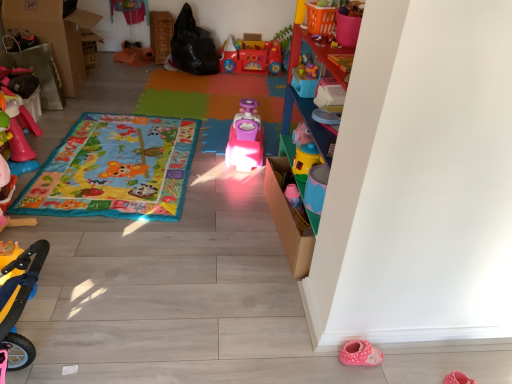
Describe the element at coordinates (215, 103) in the screenshot. I see `matte pink car at center, the first blanket when ordered from back to front` at that location.

Describe the element at coordinates (192, 46) in the screenshot. The image size is (512, 384). I see `black matte bag at upper center` at that location.

Describe the element at coordinates (245, 138) in the screenshot. I see `pink plastic toy at center, acting as the 4th toy starting from the right` at that location.

This screenshot has height=384, width=512. What are the coordinates of `pink plastic toy at center, acting as the 4th toy starting from the right` in the screenshot? It's located at (x=245, y=138).

The image size is (512, 384). What do you see at coordinates (250, 56) in the screenshot? I see `rubberized red toy car at center, which is the 3th toy in right-to-left order` at bounding box center [250, 56].

What do you see at coordinates (54, 34) in the screenshot? This screenshot has height=384, width=512. I see `cardboard box at left` at bounding box center [54, 34].

Locate an element on the screen. matte pink car at center, the first blanket when ordered from back to front is located at coordinates (215, 103).

Can you tell me how much black matte bag at upper center and yellow plastic scooter at lower left, placed as the 5th toy when sorted from right to left, differ in facing direction?

90.8 degrees separate the facing orientations of black matte bag at upper center and yellow plastic scooter at lower left, placed as the 5th toy when sorted from right to left.

From the image's perspective, which is below, black matte bag at upper center or yellow plastic scooter at lower left, the fourth toy positioned from the left?

yellow plastic scooter at lower left, the fourth toy positioned from the left, appears lower in the image.

Where is `the 1st toy counting from the left of the black matte bag at upper center`? Image resolution: width=512 pixels, height=384 pixels. the 1st toy counting from the left of the black matte bag at upper center is located at coordinates tap(19, 303).

Is black matte bag at upper center in front of or behind yellow plastic scooter at lower left, arranged as the first toy when viewed from the front, in the image?

black matte bag at upper center is positioned farther from the viewer than yellow plastic scooter at lower left, arranged as the first toy when viewed from the front.

From a real-world perspective, which object stands above the other?

From a 3D spatial view, cardboard box at left is above.

Which of these two, multicolored fabric play mat at center, which is counted as the second blanket, starting from the back, or cardboard box at left, is wider?

With larger width is multicolored fabric play mat at center, which is counted as the second blanket, starting from the back.

Based on the photo, could you tell me if multicolored fabric play mat at center, which is counted as the second blanket, starting from the back, is turned towards cardboard box at left?

No.

Which of these two, multicolored fabric play mat at center, the 1th blanket viewed from the front, or cardboard box at left, stands shorter?

multicolored fabric play mat at center, the 1th blanket viewed from the front, is shorter.

In terms of height, does black matte bag at upper center look taller or shorter compared to pink plastic toy at center, acting as the 4th toy starting from the right?

Clearly, black matte bag at upper center is taller compared to pink plastic toy at center, acting as the 4th toy starting from the right.

Between black matte bag at upper center and pink plastic toy at center, marked as the 3th toy in a back-to-front arrangement, which one is positioned in front?

Positioned in front is pink plastic toy at center, marked as the 3th toy in a back-to-front arrangement.

Is black matte bag at upper center far away from pink plastic toy at center, which is the fifth toy in left-to-right order?

Yes, black matte bag at upper center is far from pink plastic toy at center, which is the fifth toy in left-to-right order.

Is rubberized red toy car at center, which ranks as the 6th toy in left-to-right order, inside or outside of orange fabric toy at upper left, the sixth toy in the right-to-left sequence?

rubberized red toy car at center, which ranks as the 6th toy in left-to-right order, is not inside orange fabric toy at upper left, the sixth toy in the right-to-left sequence, it's outside.

Who is bigger, rubberized red toy car at center, which appears as the first toy when viewed from the back, or orange fabric toy at upper left, the sixth toy in the right-to-left sequence?

rubberized red toy car at center, which appears as the first toy when viewed from the back, is bigger.

Is point (242, 62) closer or farther from the camera than point (144, 60)?

Point (242, 62) appears to be farther away from the viewer than point (144, 60).

From the image's perspective, is rubberized red toy car at center, which is the 3th toy in right-to-left order, located above orange fabric toy at upper left, the sixth toy in the right-to-left sequence?

Yes, from the image's perspective, rubberized red toy car at center, which is the 3th toy in right-to-left order, is over orange fabric toy at upper left, the sixth toy in the right-to-left sequence.

Considering the sizes of objects yellow plastic cup at upper right, the 2th toy in the right-to-left sequence, and pink rubber shoe at upper right in the image provided, who is shorter, yellow plastic cup at upper right, the 2th toy in the right-to-left sequence, or pink rubber shoe at upper right?

With less height is pink rubber shoe at upper right.

Is point (315, 150) behind point (338, 122)?

Yes, point (315, 150) is behind point (338, 122).

Is yellow plastic cup at upper right, the 2th toy in the right-to-left sequence, wider or thinner than pink rubber shoe at upper right?

Considering their sizes, yellow plastic cup at upper right, the 2th toy in the right-to-left sequence, looks slimmer than pink rubber shoe at upper right.

Measure the distance from yellow plastic cup at upper right, which appears as the 7th toy when viewed from the left, to pink rubber shoe at upper right.

The distance of yellow plastic cup at upper right, which appears as the 7th toy when viewed from the left, from pink rubber shoe at upper right is 7.91 inches.

Locate an element on the screen. The height and width of the screenshot is (384, 512). the 1st blanket below the yellow plastic scooter at lower left, the fourth toy positioned from the left (from a real-world perspective) is located at coordinates (215, 103).

Are matte pink car at center, arranged as the second blanket when viewed from the front, and yellow plastic scooter at lower left, acting as the eighth toy starting from the back, far apart?

matte pink car at center, arranged as the second blanket when viewed from the front, is positioned a significant distance from yellow plastic scooter at lower left, acting as the eighth toy starting from the back.

Between point (205, 138) and point (0, 315), which one is positioned behind?

The point (205, 138) is behind.

Which object is wider, matte pink car at center, the first blanket when ordered from back to front, or yellow plastic scooter at lower left, acting as the eighth toy starting from the back?

With larger width is matte pink car at center, the first blanket when ordered from back to front.

Considering the sizes of objects yellow plastic cup at upper right, which appears as the 7th toy when viewed from the left, and rubberized yellow scooter at left, the seventh toy viewed from the right, in the image provided, who is wider, yellow plastic cup at upper right, which appears as the 7th toy when viewed from the left, or rubberized yellow scooter at left, the seventh toy viewed from the right,?

With larger width is yellow plastic cup at upper right, which appears as the 7th toy when viewed from the left.

Is rubberized yellow scooter at left, the 5th toy in the back-to-front sequence, located within yellow plastic cup at upper right, the 2th toy in the right-to-left sequence?

No, rubberized yellow scooter at left, the 5th toy in the back-to-front sequence, is not inside yellow plastic cup at upper right, the 2th toy in the right-to-left sequence.

Can you tell me how much yellow plastic cup at upper right, marked as the third toy in a front-to-back arrangement, and rubberized yellow scooter at left, acting as the 2th toy starting from the left, differ in facing direction?

178 degrees.

You are a GUI agent. You are given a task and a screenshot of the screen. Output one action in this format:
    pyautogui.click(x=<x>, y=<y>)
    Task: Click on the animal above the yellow plastic scooter at lower left, acting as the eighth toy starting from the back (from the image's perspective)
    The height and width of the screenshot is (384, 512).
    Given the screenshot: What is the action you would take?
    pyautogui.click(x=192, y=46)

Find the location of a particular element. Image resolution: width=512 pixels, height=384 pixels. blanket that is the 2nd one when counting forward from the cardboard box at left is located at coordinates (115, 169).

Estimate the real-world distances between objects in this image. Which object is further from rubberized pink toy at left, placed as the 5th toy when sorted from front to back, yellow plastic scooter at lower left, arranged as the first toy when viewed from the front, or pink plastic toy at center, acting as the 4th toy starting from the right?

The object further to rubberized pink toy at left, placed as the 5th toy when sorted from front to back, is yellow plastic scooter at lower left, arranged as the first toy when viewed from the front.

When comparing their distances from orange fabric toy at upper left, placed as the third toy when sorted from left to right, does multicolored fabric play mat at center, the 1th blanket viewed from the front, or matte pink car at center, arranged as the second blanket when viewed from the front, seem further?

Among the two, multicolored fabric play mat at center, the 1th blanket viewed from the front, is located further to orange fabric toy at upper left, placed as the third toy when sorted from left to right.

Looking at the image, which one is located closer to rubberized yellow scooter at left, the fourth toy viewed from the front, rubberized pink toy at left, placed as the 5th toy when sorted from front to back, or yellow plastic cup at upper right, acting as the sixth toy starting from the back?

rubberized pink toy at left, placed as the 5th toy when sorted from front to back, is closer to rubberized yellow scooter at left, the fourth toy viewed from the front.

Looking at the image, which one is located further to rubberized pink toy at left, which is counted as the 8th toy, starting from the right, orange fabric toy at upper left, the 2th toy positioned from the back, or pink plastic toy at center, which is the fifth toy in left-to-right order?

orange fabric toy at upper left, the 2th toy positioned from the back.

Looking at the image, which one is located closer to rubberized yellow scooter at left, the 5th toy in the back-to-front sequence, orange fabric toy at upper left, the sixth toy in the right-to-left sequence, or pink plastic toy at center, which is the fifth toy in left-to-right order?

Result: pink plastic toy at center, which is the fifth toy in left-to-right order, is positioned closer to the anchor rubberized yellow scooter at left, the 5th toy in the back-to-front sequence.

Looking at the image, which one is located further to matte pink car at center, the first blanket when ordered from back to front, rubberized pink toy at left, placed as the 5th toy when sorted from front to back, or cardboard box at left?

rubberized pink toy at left, placed as the 5th toy when sorted from front to back, is positioned further to the anchor matte pink car at center, the first blanket when ordered from back to front.

Considering their positions, is yellow plastic scooter at lower left, acting as the eighth toy starting from the back, positioned closer to black matte bag at upper center than pink plastic toy at center, which is the fifth toy in left-to-right order?

pink plastic toy at center, which is the fifth toy in left-to-right order, is closer to black matte bag at upper center.

Which object lies further to the anchor point rubberized red toy car at center, which appears as the 8th toy when viewed from the front, yellow plastic scooter at lower left, placed as the 5th toy when sorted from right to left, or multicolored fabric play mat at center, which is counted as the second blanket, starting from the back?

yellow plastic scooter at lower left, placed as the 5th toy when sorted from right to left.

Identify the location of cardboard box positioned between rubberized pink toy at left, positioned as the 1th toy in left-to-right order, and orange fabric toy at upper left, placed as the seventh toy when sorted from front to back, from near to far. The width and height of the screenshot is (512, 384). (54, 34).

Where is `blanket positioned between pink plastic toy at center, acting as the 4th toy starting from the right, and rubberized red toy car at center, which is the 3th toy in right-to-left order, from near to far`? The width and height of the screenshot is (512, 384). blanket positioned between pink plastic toy at center, acting as the 4th toy starting from the right, and rubberized red toy car at center, which is the 3th toy in right-to-left order, from near to far is located at coordinates (215, 103).

Find the location of a particular element. The width and height of the screenshot is (512, 384). animal between orange fabric toy at upper left, the sixth toy in the right-to-left sequence, and rubberized red toy car at center, which appears as the 8th toy when viewed from the front, from left to right is located at coordinates (192, 46).

The image size is (512, 384). Find the location of `footwear located between yellow plastic scooter at lower left, acting as the eighth toy starting from the back, and black matte bag at upper center in the depth direction`. footwear located between yellow plastic scooter at lower left, acting as the eighth toy starting from the back, and black matte bag at upper center in the depth direction is located at coordinates (326, 117).